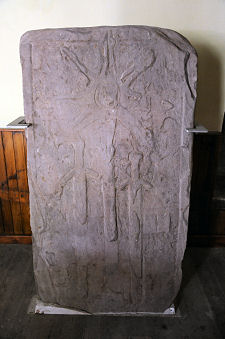
Identify the location of wood paneling on lower part of wall. (19, 175), (202, 205).